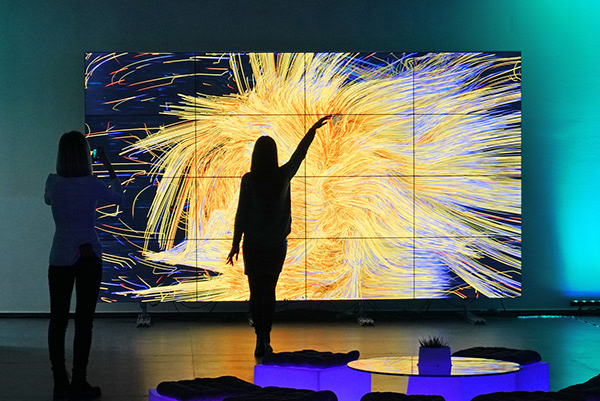
This screenshot has height=401, width=600. What are the coordinates of `metal legs holding up the led screen` in the screenshot? It's located at (142, 320), (249, 320), (365, 320), (473, 320).